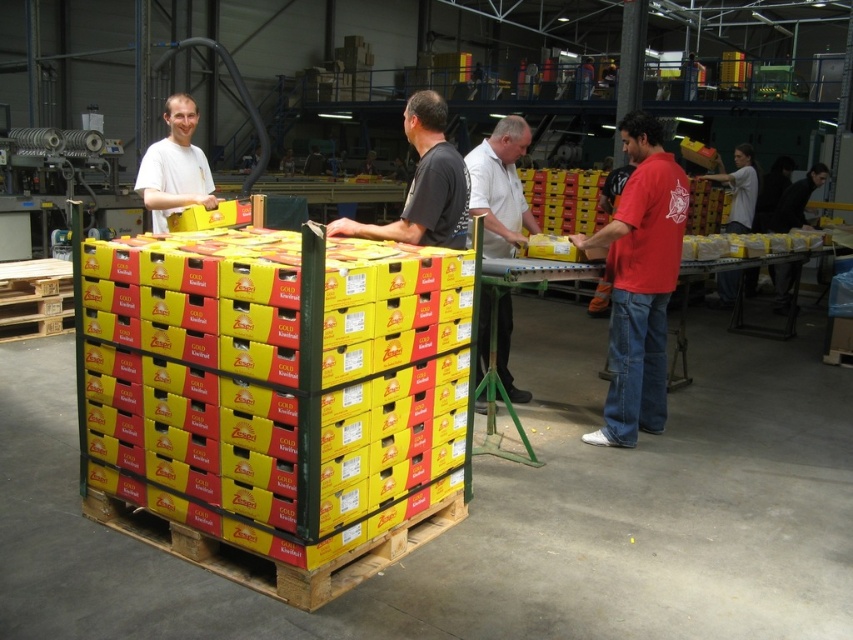
You are a warehouse supervisor observing the workers. You notice two workers wearing white shirts in the scene. Which worker, the white matte shirt at center or the matte white shirt at left, is closer to you?

The white matte shirt at center is closer to the viewer than the matte white shirt at left.

You are a warehouse supervisor who needs to communicate with both workers wearing the red cotton shirt at right and the white matte shirt at center. Given that your voice can carry up to 30 inches, can you address both workers without moving closer?

The red cotton shirt at right is 27.81 inches from the white matte shirt at center. Since your voice can carry up to 30 inches, you can address both workers without moving closer as the distance between them is within the range.